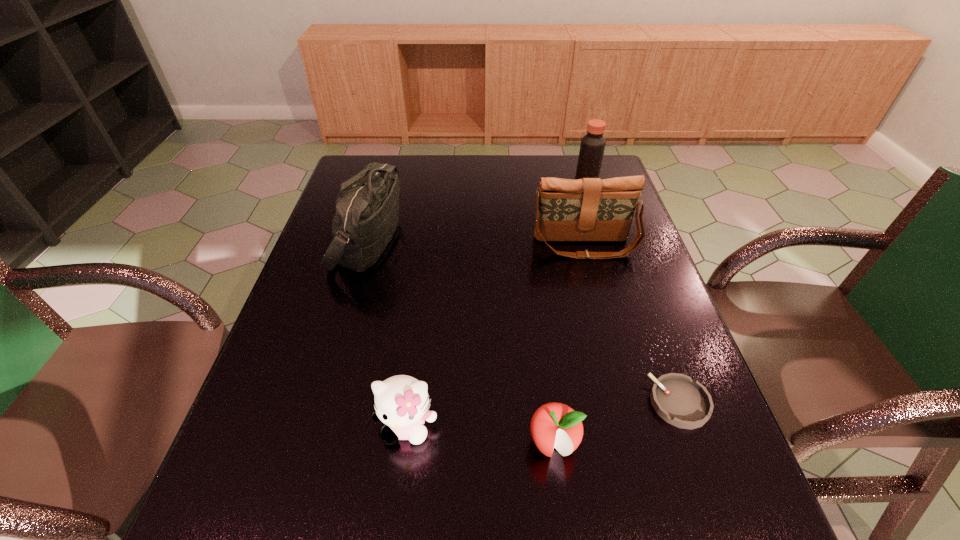
You are a GUI agent. You are given a task and a screenshot of the screen. Output one action in this format:
    pyautogui.click(x=<x>, y=<y>)
    Task: Click on the empty location between the vinegar and the ashtray
    The height and width of the screenshot is (540, 960).
    Given the screenshot: What is the action you would take?
    pyautogui.click(x=633, y=294)

This screenshot has width=960, height=540. I want to click on vacant space that's between the fifth object from right to left and the left shoulder bag, so click(x=387, y=334).

Find the location of `the fourth closest object to the ashtray`. the fourth closest object to the ashtray is located at coordinates (367, 207).

Identify which object is the second nearest to the right shoulder bag. Please provide its 2D coordinates. Your answer should be formatted as a tuple, i.e. [(x, y)], where the tuple contains the x and y coordinates of a point satisfying the conditions above.

[(367, 207)]

At what (x,y) coordinates should I click in order to perform the action: click on free space that satisfies the following two spatial constraints: 1. at the front padded panel of the ashtray; 2. on the left side of the left shoulder bag. Please return your answer as a coordinate pair (x, y). Looking at the image, I should click on (323, 403).

At what (x,y) coordinates should I click in order to perform the action: click on vacant region that satisfies the following two spatial constraints: 1. at the front padded panel of the left shoulder bag; 2. on the right side of the fifth tallest object. Please return your answer as a coordinate pair (x, y). The width and height of the screenshot is (960, 540). Looking at the image, I should click on (310, 443).

At what (x,y) coordinates should I click in order to perform the action: click on free spot that satisfies the following two spatial constraints: 1. at the front padded panel of the shortest object; 2. on the right side of the left shoulder bag. Please return your answer as a coordinate pair (x, y). This screenshot has height=540, width=960. Looking at the image, I should click on (323, 403).

At what (x,y) coordinates should I click in order to perform the action: click on vacant space that satisfies the following two spatial constraints: 1. at the front padded panel of the leftmost object; 2. on the back side of the apple. Please return your answer as a coordinate pair (x, y). This screenshot has width=960, height=540. Looking at the image, I should click on (310, 443).

Identify the location of free location that satisfies the following two spatial constraints: 1. on the front-facing side of the right shoulder bag; 2. on the right side of the ashtray. This screenshot has height=540, width=960. (627, 403).

Find the location of `vacant area that satisfies the following two spatial constraints: 1. at the front padded panel of the second shortest object; 2. on the right side of the left shoulder bag`. vacant area that satisfies the following two spatial constraints: 1. at the front padded panel of the second shortest object; 2. on the right side of the left shoulder bag is located at coordinates (310, 443).